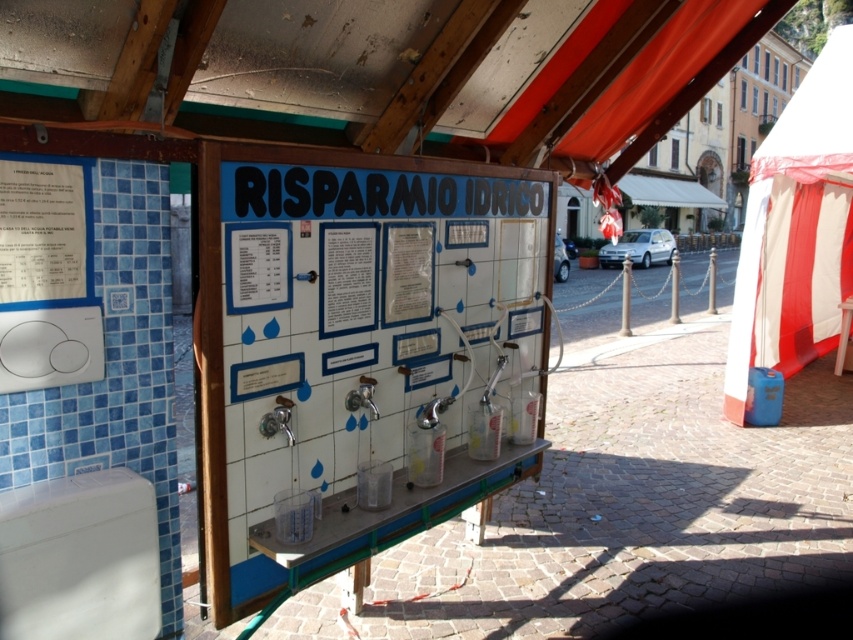
Is white tile board at center bigger than white paper at left?

Yes, white tile board at center is bigger than white paper at left.

Which is more to the right, white tile board at center or white paper at left?

white tile board at center

Image resolution: width=853 pixels, height=640 pixels. Describe the element at coordinates (364, 316) in the screenshot. I see `white tile board at center` at that location.

Where is `white tile board at center`? The height and width of the screenshot is (640, 853). white tile board at center is located at coordinates (364, 316).